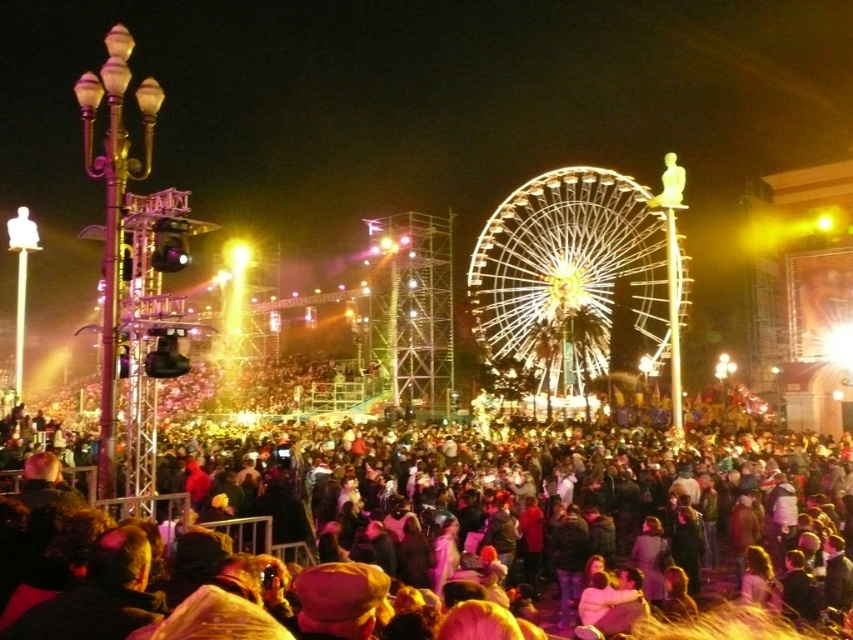
You are standing at the point marked as point (675, 609) in the image. The Ferris wheel is behind you. You want to move to the stage setup to the left of the Ferris wheel. Can you walk straight ahead from your current position to reach the stage setup without needing to turn?

Since the Ferris wheel is behind you and the stage setup is to the left of the Ferris wheel, you would need to turn left to face the stage setup before walking forward. Walking straight ahead from your current position would not directly lead you to the stage setup.

You are standing at the entrance of the fairground and want to take a photo of the illuminated steel ferris wheel at center without any people in the frame. Given that the dark brown fabric crowd at center is blocking your view, how can you adjust your position to capture the ferris wheel clearly?

Since the dark brown fabric crowd at center is closer to the viewer than the illuminated steel ferris wheel at center, you can move to a higher position or shift your angle to position yourself above the crowd to get a clear view of the ferris wheel.

You are standing at the center of the Ferris wheel and want to move towards the dark brown fabric crowd at center. Which direction should you go?

Since the dark brown fabric crowd at center is located at point (474, 516), you should move towards the center of the scene to reach them.